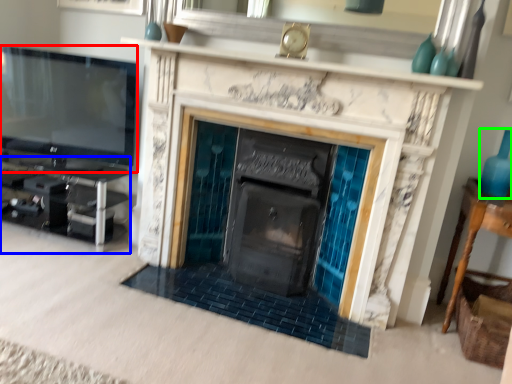
Question: Which object is the farthest from television (highlighted by a red box)? Choose among these: entertainment center (highlighted by a blue box) or glass vase (highlighted by a green box).

Choices:
 (A) entertainment center
 (B) glass vase

Answer: (B)